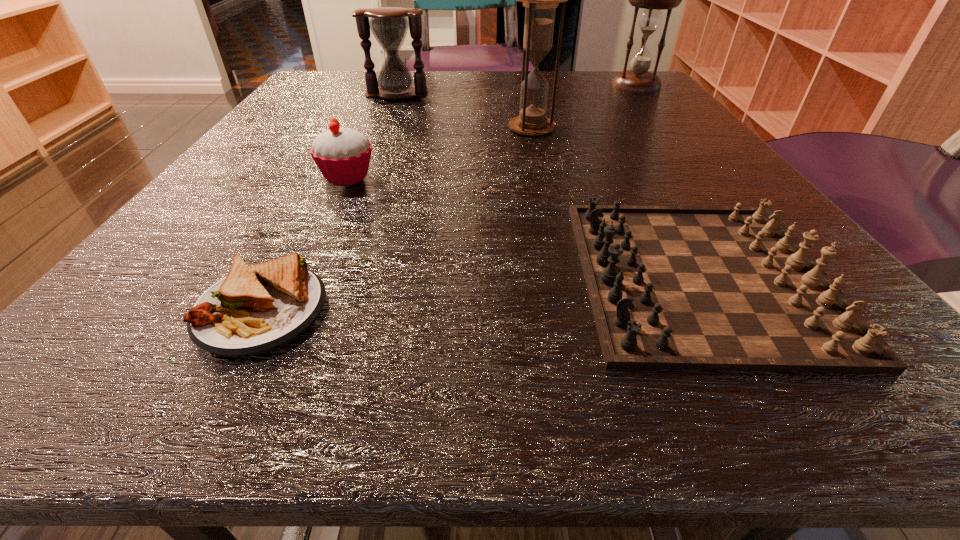
At what (x,y) coordinates should I click in order to perform the action: click on the tallest object. Please return your answer as a coordinate pair (x, y). Image resolution: width=960 pixels, height=540 pixels. Looking at the image, I should click on (540, 0).

Where is `the nearest hourglass`? the nearest hourglass is located at coordinates pos(540,0).

Find the location of a particular element. This screenshot has height=540, width=960. the rightmost hourglass is located at coordinates (637, 80).

Find the location of a particular element. The height and width of the screenshot is (540, 960). the leftmost hourglass is located at coordinates (389, 25).

This screenshot has width=960, height=540. What are the coordinates of `cupcake` in the screenshot? It's located at (342, 155).

You are a GUI agent. You are given a task and a screenshot of the screen. Output one action in this format:
    pyautogui.click(x=<x>, y=<y>)
    Task: Click on the third shortest object
    This screenshot has width=960, height=540.
    Given the screenshot: What is the action you would take?
    (x=342, y=155)

Find the location of a particular element. the second shortest object is located at coordinates (671, 287).

The image size is (960, 540). I want to click on sandwich, so click(255, 309).

The width and height of the screenshot is (960, 540). Find the location of `blank area located on the back of the second hourglass from left to right`. blank area located on the back of the second hourglass from left to right is located at coordinates (526, 104).

Find the location of a particular element. vacant area located on the left of the rightmost hourglass is located at coordinates (437, 86).